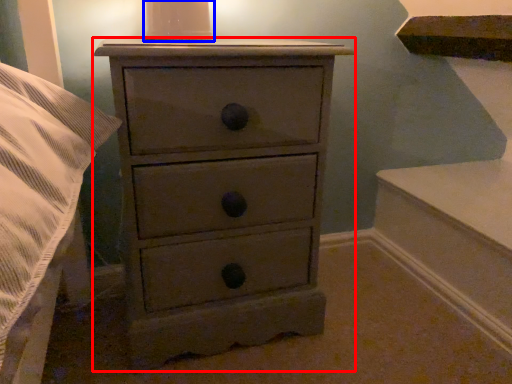
Question: Which object is closer to the camera taking this photo, chest of drawers (highlighted by a red box) or candle holder (highlighted by a blue box)?

Choices:
 (A) chest of drawers
 (B) candle holder

Answer: (A)